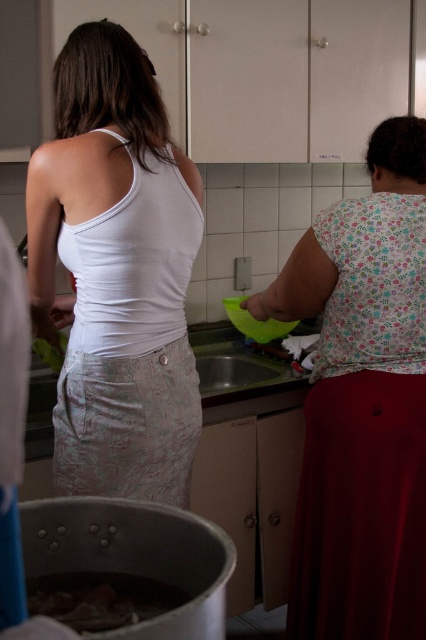
You are a chef standing in the kitchen and need to reach both the white lace tank top at center and the satin silver sink at center. Which object is closer to your right side?

The satin silver sink at center is closer to your right side because the white lace tank top at center is positioned to its left.